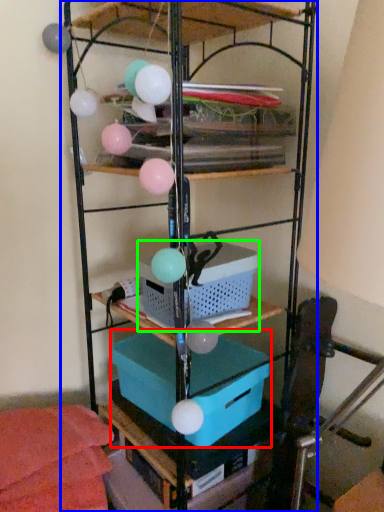
Question: Estimate the real-world distances between objects in this image. Which object is farther from box (highlighted by a red box), shelf (highlighted by a blue box) or basket (highlighted by a green box)?

Choices:
 (A) shelf
 (B) basket

Answer: (A)